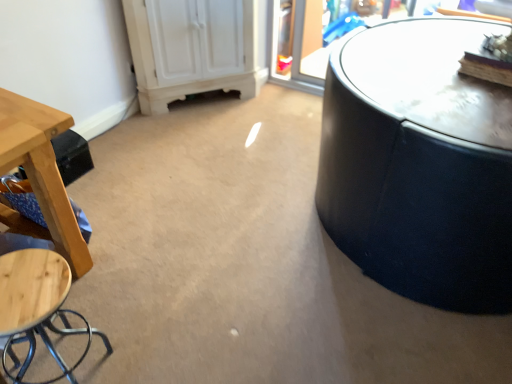
Question: From the image's perspective, is wooden stool at left located above or below wooden stool at lower left?

Choices:
 (A) above
 (B) below

Answer: (A)

Question: Do you think wooden stool at left is within wooden stool at lower left, or outside of it?

Choices:
 (A) inside
 (B) outside

Answer: (B)

Question: Based on their sizes in the image, would you say wooden stool at left is bigger or smaller than wooden stool at lower left?

Choices:
 (A) small
 (B) big

Answer: (B)

Question: From the image's perspective, relative to wooden stool at left, is wooden stool at lower left above or below?

Choices:
 (A) below
 (B) above

Answer: (A)

Question: Based on their sizes in the image, would you say wooden stool at lower left is bigger or smaller than wooden stool at left?

Choices:
 (A) big
 (B) small

Answer: (B)

Question: From their relative heights in the image, would you say wooden stool at lower left is taller or shorter than wooden stool at left?

Choices:
 (A) tall
 (B) short

Answer: (A)

Question: In the image, is wooden stool at lower left on the left side or the right side of wooden stool at left?

Choices:
 (A) left
 (B) right

Answer: (B)